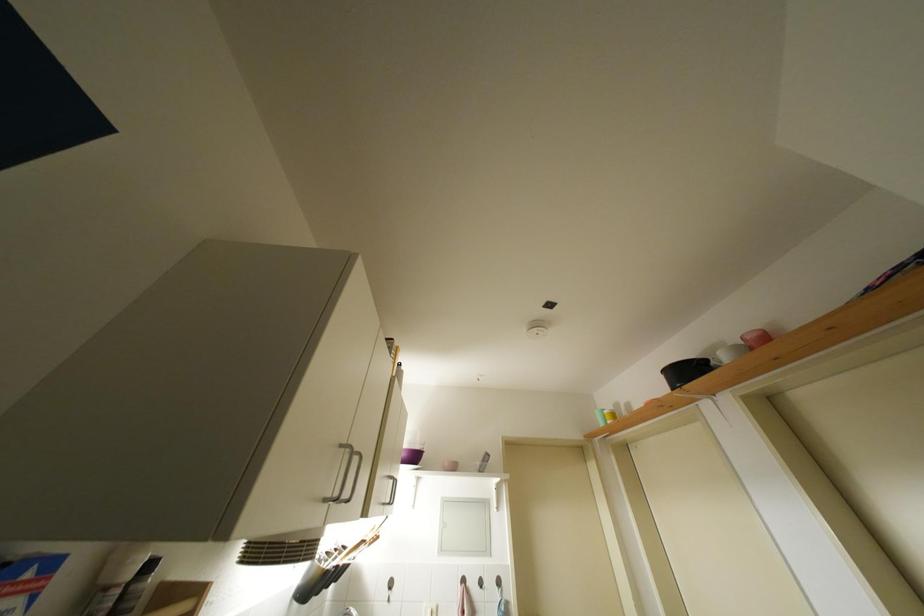
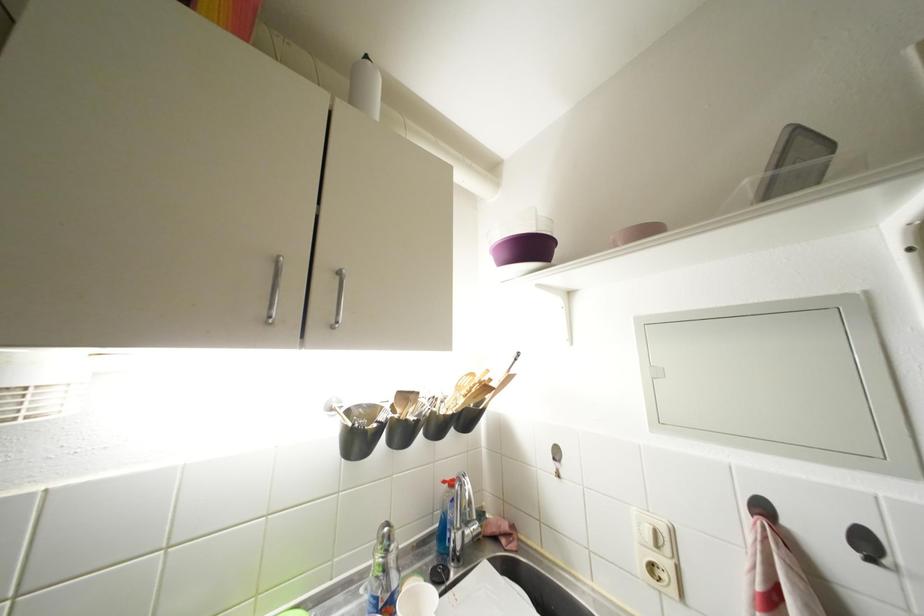
The point at (410,459) is marked in the first image. Where is the corresponding point in the second image?

(512, 259)